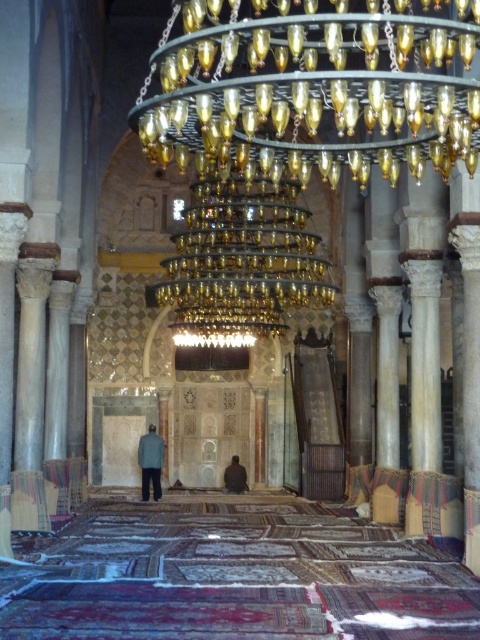
You are standing in the grand mosque and want to take a photo of the gold metallic chandelier at upper center. The camera you have can focus on objects up to 20 meters away. Will the chandelier be in focus?

The gold metallic chandelier at upper center is 21.64 meters from viewer, which is beyond the camera focus limit of 20 meters. The chandelier will not be in focus.